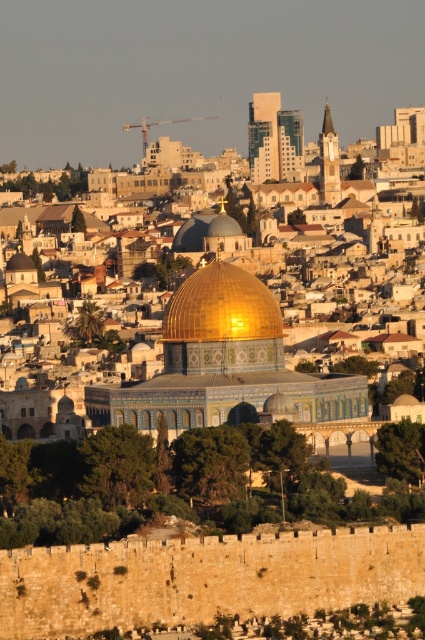
You are a tourist standing in front of the ancient stone wall in the foreground of the cityscape. You see two domes in the distance. The first is the golden reflective dome at center, and the second is the goldshinydome at center. Which of these two domes is positioned more to the right side of the scene?

The golden reflective dome at center is positioned more to the right side of the scene compared to the goldshinydome at center.

You are standing at the base of the ancient stone wall in the foreground of the cityscape image. You want to reach the point marked at coordinates point (272,324). Given that your walking speed is 1.5 meters per second, how many seconds will it take you to reach that point?

The distance of point (272,324) from camera is 252.41 meters, so it will take 252.41 divided by 1.5 equals approximately 168.27 seconds to reach the point.

You are a tourist standing in front of the ancient stone wall in the foreground of the cityscape. You see two domes in the distance. Which dome, the golden reflective dome at center or the goldshinydome at center, is closer to you?

The golden reflective dome at center is closer to the viewer than the goldshinydome at center.